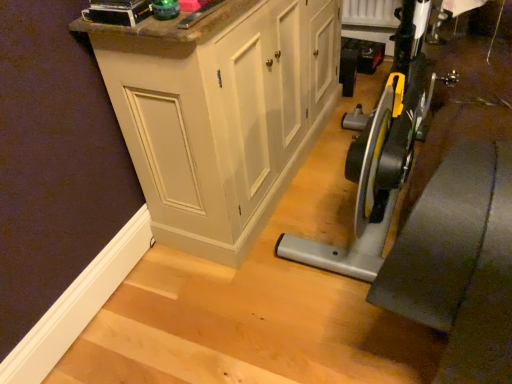
Question: Is point (192, 23) closer or farther from the camera than point (242, 13)?

Choices:
 (A) closer
 (B) farther

Answer: (A)

Question: Is green plastic bottle at upper center wider or thinner than matte white cabinet at center?

Choices:
 (A) wide
 (B) thin

Answer: (B)

Question: From their relative heights in the image, would you say green plastic bottle at upper center is taller or shorter than matte white cabinet at center?

Choices:
 (A) short
 (B) tall

Answer: (A)

Question: Considering the positions of matte white cabinet at center and green plastic bottle at upper center in the image, is matte white cabinet at center bigger or smaller than green plastic bottle at upper center?

Choices:
 (A) small
 (B) big

Answer: (B)

Question: From a real-world perspective, relative to green plastic bottle at upper center, is matte white cabinet at center vertically above or below?

Choices:
 (A) above
 (B) below

Answer: (B)

Question: From the image's perspective, is matte white cabinet at center located above or below green plastic bottle at upper center?

Choices:
 (A) above
 (B) below

Answer: (A)

Question: Considering the relative positions of matte white cabinet at center and green plastic bottle at upper center in the image provided, is matte white cabinet at center to the left or to the right of green plastic bottle at upper center?

Choices:
 (A) left
 (B) right

Answer: (B)